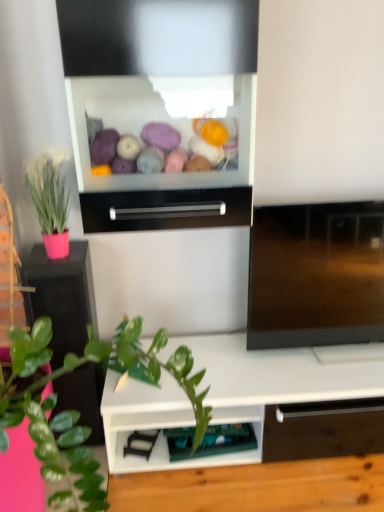
Question: Is pink matte plant pot at left to the left or to the right of green plastic shelf at lower center in the image?

Choices:
 (A) left
 (B) right

Answer: (A)

Question: From the image's perspective, relative to green plastic shelf at lower center, is pink matte plant pot at left above or below?

Choices:
 (A) above
 (B) below

Answer: (A)

Question: Which object is the farthest from the matte pink pot at left?

Choices:
 (A) black glossy drawer at center
 (B) green plastic shelf at lower center
 (C) pink matte plant pot at left

Answer: (B)

Question: Which is nearer to the green plastic shelf at lower center?

Choices:
 (A) matte pink pot at left
 (B) pink matte plant pot at left
 (C) black glossy drawer at center

Answer: (B)